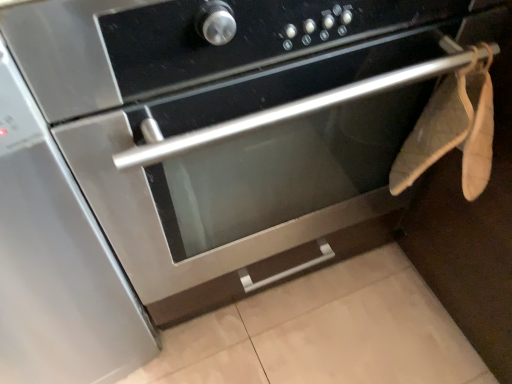
Describe the element at coordinates (56, 262) in the screenshot. The image size is (512, 384). I see `satin silver oven at left` at that location.

Identify the location of satin silver oven at left. (56, 262).

The image size is (512, 384). What are the coordinates of `satin silver oven at left` in the screenshot? It's located at (56, 262).